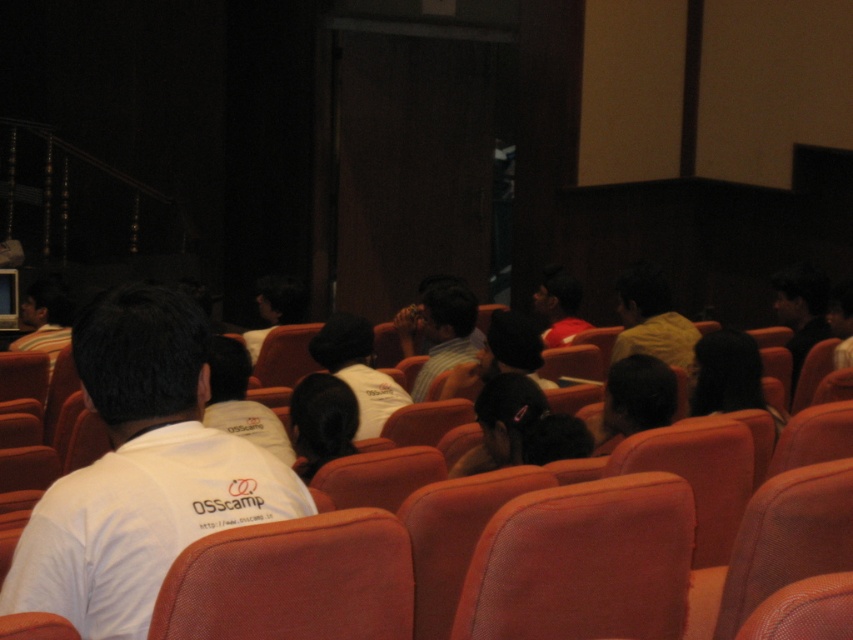
Question: From the image, what is the correct spatial relationship of white cotton t-shirt at left in relation to matte black shirt at upper right?

Choices:
 (A) above
 (B) below

Answer: (B)

Question: Can you confirm if white matte shirt at center is smaller than matte white shirt at center?

Choices:
 (A) no
 (B) yes

Answer: (A)

Question: Which is farther from the matte black shirt at upper right?

Choices:
 (A) matte white shirt at center
 (B) matte red shirt at center
 (C) white t-shirt at left

Answer: (C)

Question: Where is matte black shirt at upper right located in relation to white t-shirt at left in the image?

Choices:
 (A) left
 (B) right

Answer: (B)

Question: Which is nearer to the matte white shirt at center?

Choices:
 (A) red fabric chair at center
 (B) white t-shirt at left
 (C) white cotton t-shirt at left

Answer: (B)

Question: Which object is farther from the camera taking this photo?

Choices:
 (A) yellow matte shirt at center
 (B) black fabric head at center
 (C) matte black shirt at upper right

Answer: (C)